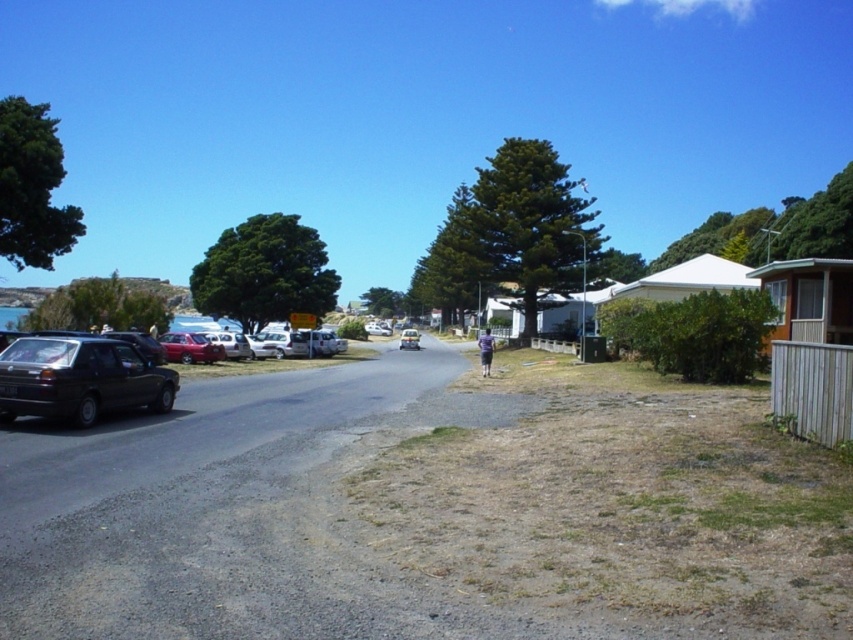
You are standing at the point with coordinates point (486,333) and want to walk towards the point with coordinates point (173,332). Which direction should you face to walk directly towards it?

Point (173,332) is closer to the viewer than point (486,333), so you should face upwards to walk directly towards it.

You are a delivery driver who needs to park your vehicle in this area. You have a truck that is 2 meters wide. The metallic red car at left and the silver metallic car at center are parked here. Can your truck fit between them if you park in the space between these two cars?

The metallic red car at left is wider than the silver metallic car at center. Therefore, the space between them may not be wide enough for a 2 meter wide truck. You should look for another parking spot.